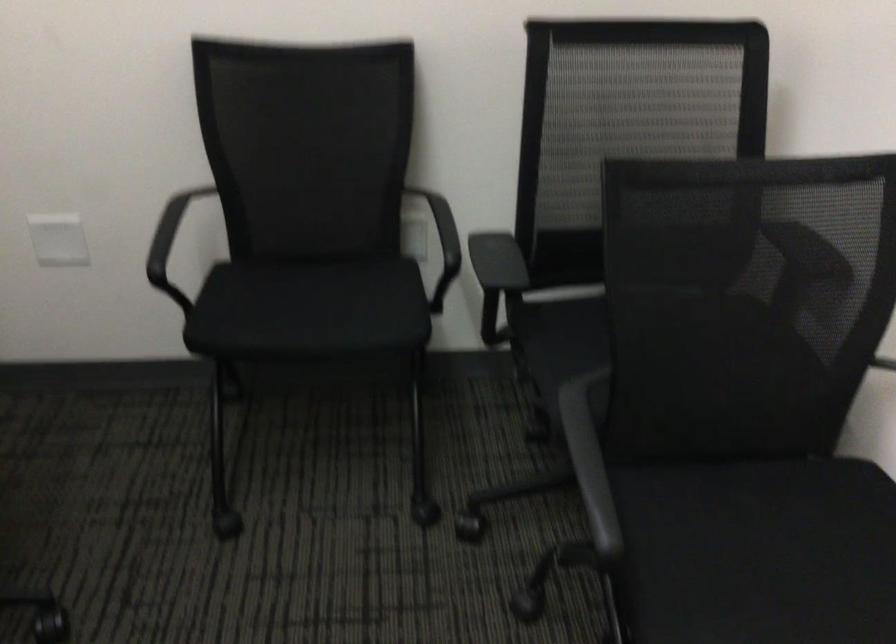
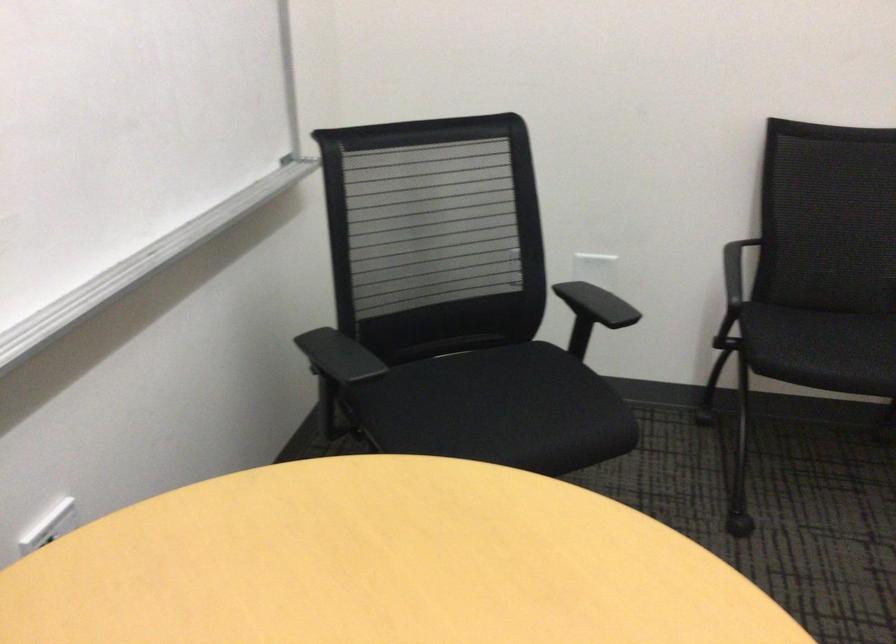
Where in the second image is the point corresponding to the point at 280,312 from the first image?

(821, 348)